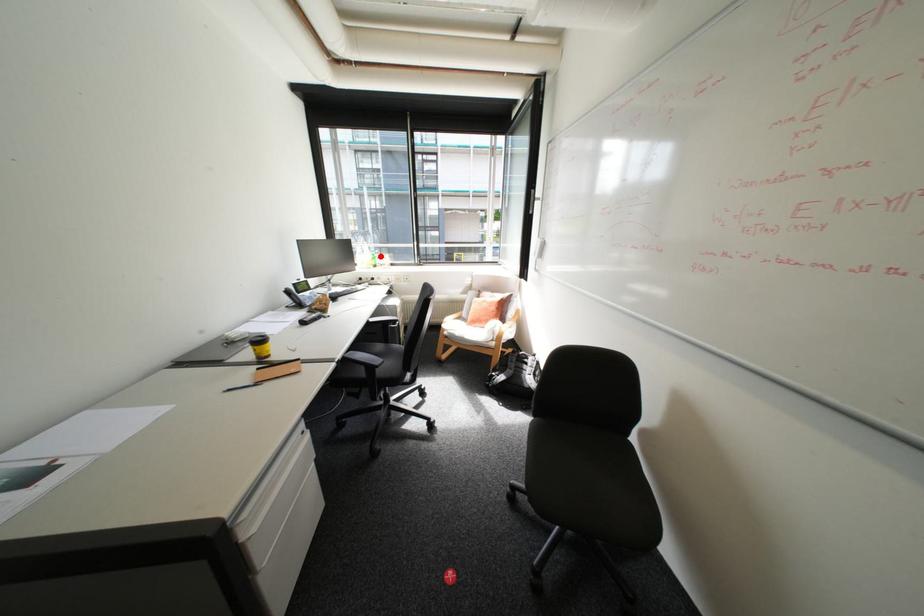
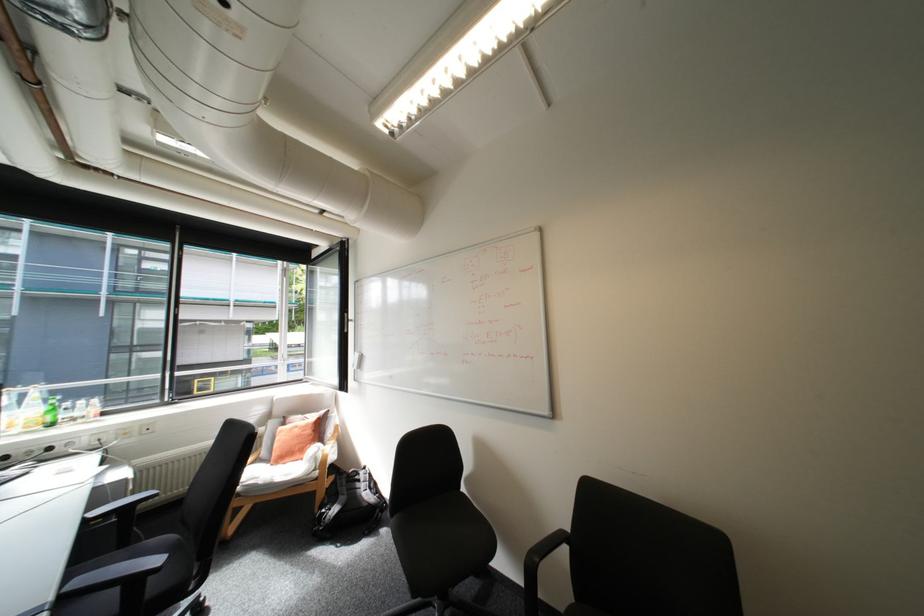
Question: I am providing you with two images of the same scene from different viewpoints. A red point is marked on the first image. Is the red point's position out of view in image 2?

Choices:
 (A) Yes
 (B) No

Answer: (B)